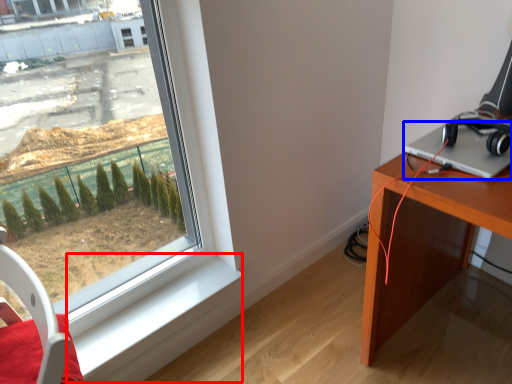
Question: Which object appears farthest to the camera in this image, window sill (highlighted by a red box) or laptop (highlighted by a blue box)?

Choices:
 (A) window sill
 (B) laptop

Answer: (A)